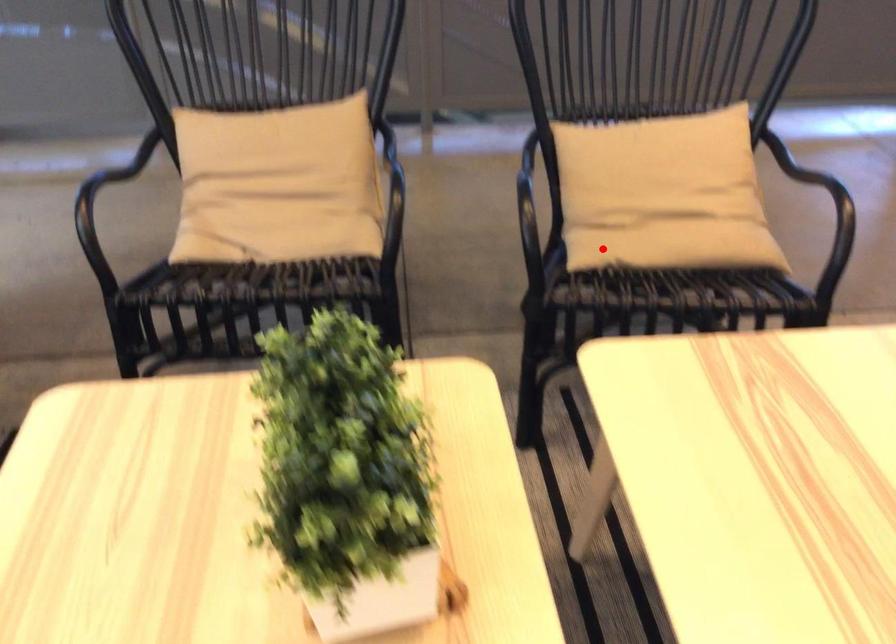
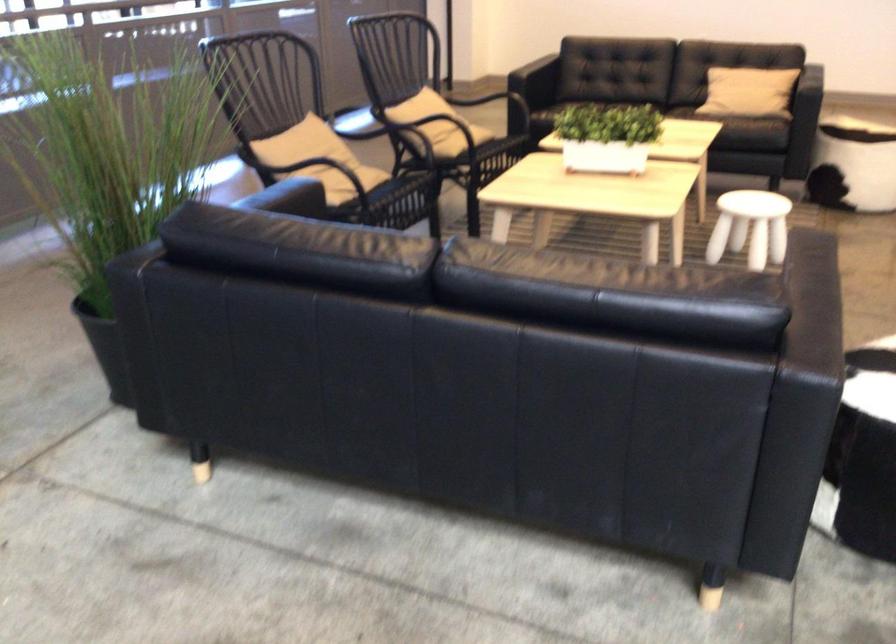
Locate, in the second image, the point that corresponds to the highlighted location in the first image.

(462, 140)